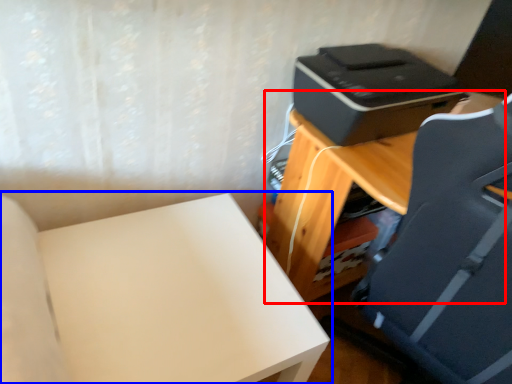
Question: Which of the following is the farthest to the observer, table (highlighted by a red box) or furniture (highlighted by a blue box)?

Choices:
 (A) table
 (B) furniture

Answer: (B)